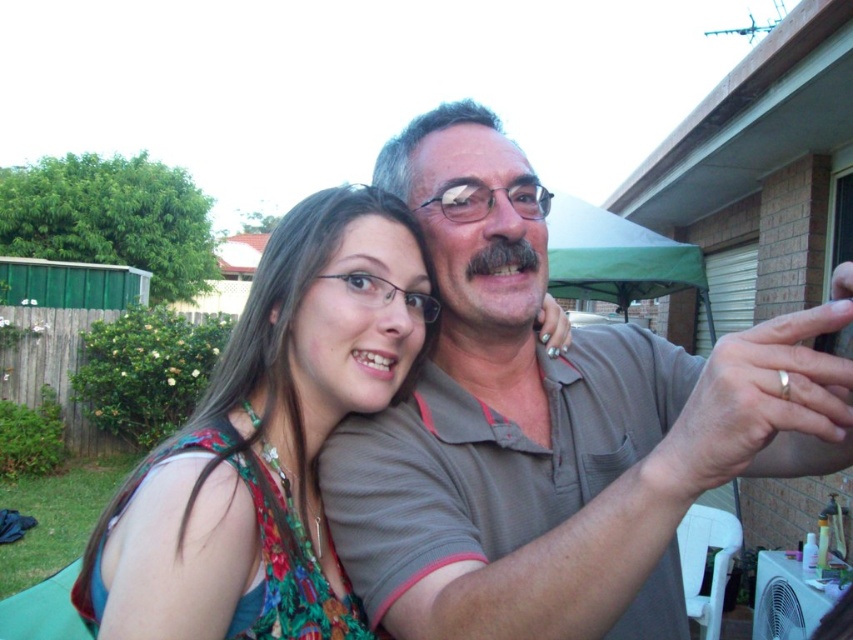
Which is more to the right, gray cotton shirt at center or floral fabric dress at center?

Positioned to the right is gray cotton shirt at center.

Does gray cotton shirt at center have a greater width compared to floral fabric dress at center?

Yes, gray cotton shirt at center is wider than floral fabric dress at center.

This screenshot has width=853, height=640. Describe the element at coordinates (552, 428) in the screenshot. I see `gray cotton shirt at center` at that location.

At what (x,y) coordinates should I click in order to perform the action: click on gray cotton shirt at center. Please return your answer as a coordinate pair (x, y). Looking at the image, I should click on (552, 428).